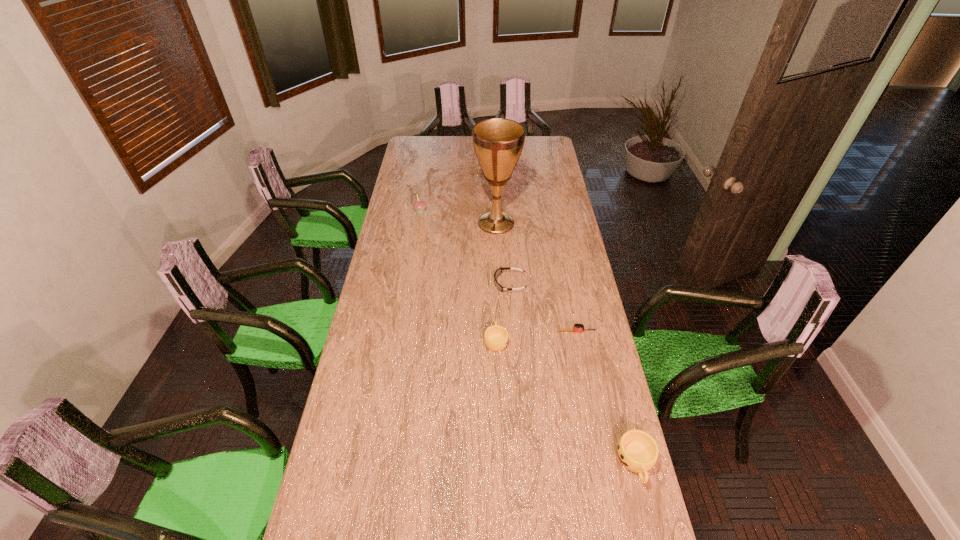
Locate an element on the screen. The height and width of the screenshot is (540, 960). free region located 0.220m on the back of the left cup is located at coordinates (494, 288).

Where is `vacant area situated on the left of the nearer cup`? The width and height of the screenshot is (960, 540). vacant area situated on the left of the nearer cup is located at coordinates (501, 462).

At what (x,y) coordinates should I click in order to perform the action: click on free space located on the front of the trophy cup. Please return your answer as a coordinate pair (x, y). The width and height of the screenshot is (960, 540). Looking at the image, I should click on (497, 254).

Identify the location of free location located on the front and sides of the fifth tallest object. (468, 284).

The image size is (960, 540). I want to click on vacant region located 0.050m on the front and sides of the fifth tallest object, so click(482, 284).

The image size is (960, 540). I want to click on vacant space located 0.400m on the front and sides of the fifth tallest object, so click(x=399, y=284).

This screenshot has width=960, height=540. I want to click on free location located 0.360m on the right of the leftmost object, so click(497, 211).

Identify the location of vacant space located on the left of the tape measure. The width and height of the screenshot is (960, 540). (540, 332).

Where is `object that is at the near edge`? Image resolution: width=960 pixels, height=540 pixels. object that is at the near edge is located at coordinates (637, 451).

Find the location of a particular element. This screenshot has width=960, height=540. object situated at the left edge is located at coordinates (419, 205).